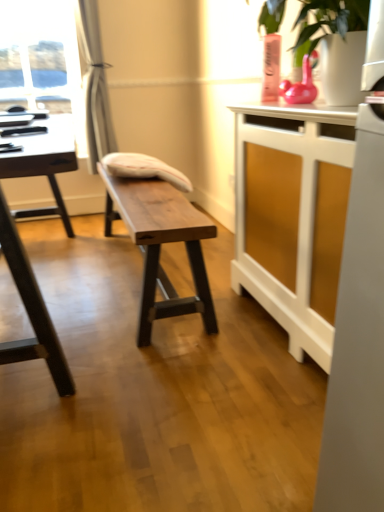
Locate an element on the screen. The width and height of the screenshot is (384, 512). free spot below black glossy table at left, the 3th table from the right (from a real-world perspective) is located at coordinates (54, 294).